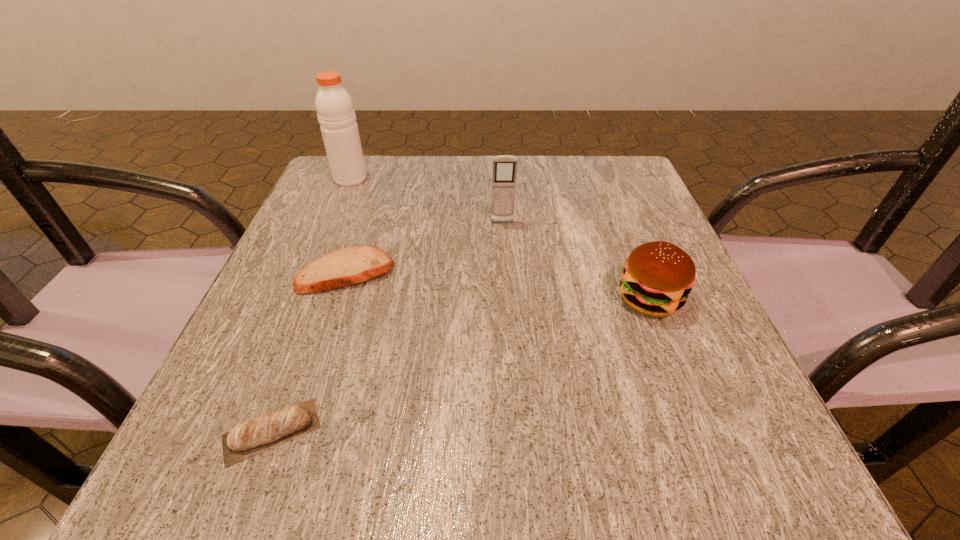
Identify the location of free space that is in between the nearest object and the shaker. Image resolution: width=960 pixels, height=540 pixels. (311, 305).

Locate an element on the screen. Image resolution: width=960 pixels, height=540 pixels. free area in between the second tallest object and the farther pita bread is located at coordinates (424, 248).

You are a GUI agent. You are given a task and a screenshot of the screen. Output one action in this format:
    pyautogui.click(x=<x>, y=<y>)
    Task: Click on the free space between the hamburger and the farther pita bread
    The height and width of the screenshot is (540, 960).
    Given the screenshot: What is the action you would take?
    pyautogui.click(x=498, y=286)

Locate an element on the screen. vacant area that lies between the farther pita bread and the rightmost object is located at coordinates (498, 286).

Identify which object is located as the nearest to the nearest object. Please provide its 2D coordinates. Your answer should be formatted as a tuple, i.e. [(x, y)], where the tuple contains the x and y coordinates of a point satisfying the conditions above.

[(349, 266)]

This screenshot has height=540, width=960. In order to click on object that is the third closest one to the nearest object in this screenshot , I will do `click(504, 166)`.

Find the location of `vacant region that satisfies the following two spatial constraints: 1. on the front side of the farther pita bread; 2. on the right side of the shaker`. vacant region that satisfies the following two spatial constraints: 1. on the front side of the farther pita bread; 2. on the right side of the shaker is located at coordinates click(x=311, y=273).

Identify the location of free space that satisfies the following two spatial constraints: 1. on the front side of the rightmost object; 2. on the right side of the farthest object. (300, 299).

Where is `vacant region that satisfies the following two spatial constraints: 1. on the front side of the farthest object; 2. on the right side of the third shortest object`? The height and width of the screenshot is (540, 960). vacant region that satisfies the following two spatial constraints: 1. on the front side of the farthest object; 2. on the right side of the third shortest object is located at coordinates (300, 299).